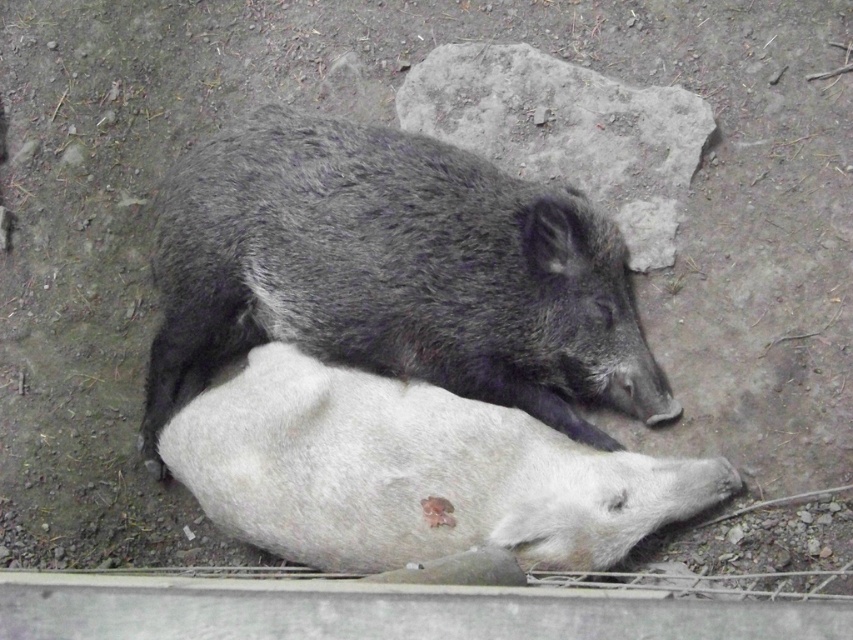
You are a wildlife photographer observing two pigs in a forest clearing. You see a gray fur pig at center and a white matte pig at center. Which pig is positioned to the left when viewed from your perspective?

The gray fur pig at center is positioned to the left of the white matte pig at center.

You are a farmer who needs to fit both the white matte pig at center and the gray rough rock at upper center into a transport crate. The crate can only accommodate items up to the size of the larger object. Which object determines the minimum required crate width?

The white matte pig at center determines the minimum required crate width because its width is larger than the gray rough rock at upper center.

In the scene shown: You are a wildlife photographer trying to capture a closeup of the gray fur pig at center. You are currently standing at point [393,273]. Is this point on the gray fur pig at center?

Yes, the point [393,273] is on the gray fur pig at center according to the description.